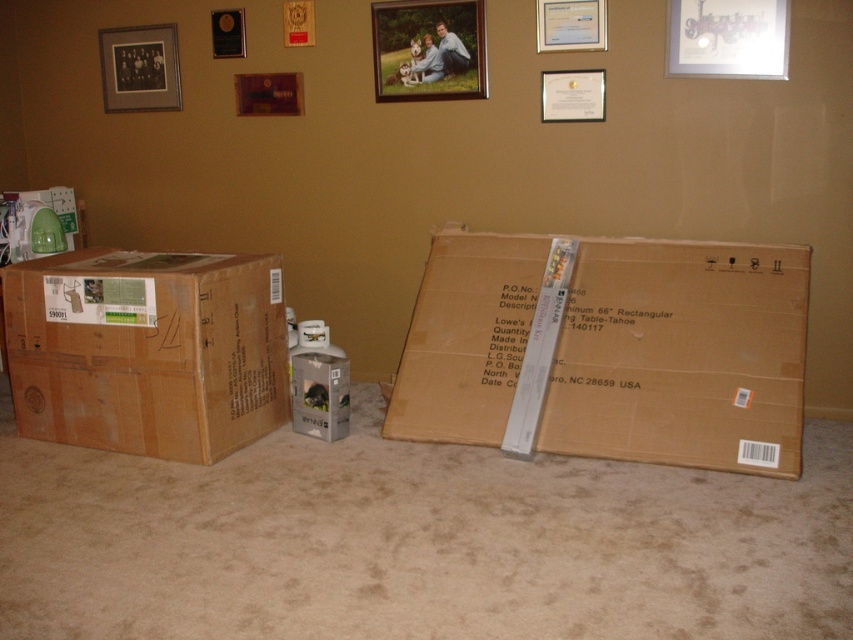
You are organizing the room and want to hang the metallic silver picture frame at upper right on the wall. However, there is a brown cardboard box at left in the way. Can you hang the frame without moving the box?

The brown cardboard box at left is in front of the metallic silver picture frame at upper right, meaning the box is blocking access to the frame. To hang the frame, you would need to move the box first to reach the wall behind it.

You are standing in the room and want to move from the point at coordinates (572, 115) to the point at coordinates (222, 10). Can you walk directly between these two points without any obstacles?

Yes, you can walk directly between the point at coordinates (572, 115) and the point at coordinates (222, 10) because the first point is in front of the second point, indicating there is no obstruction blocking the path between them.